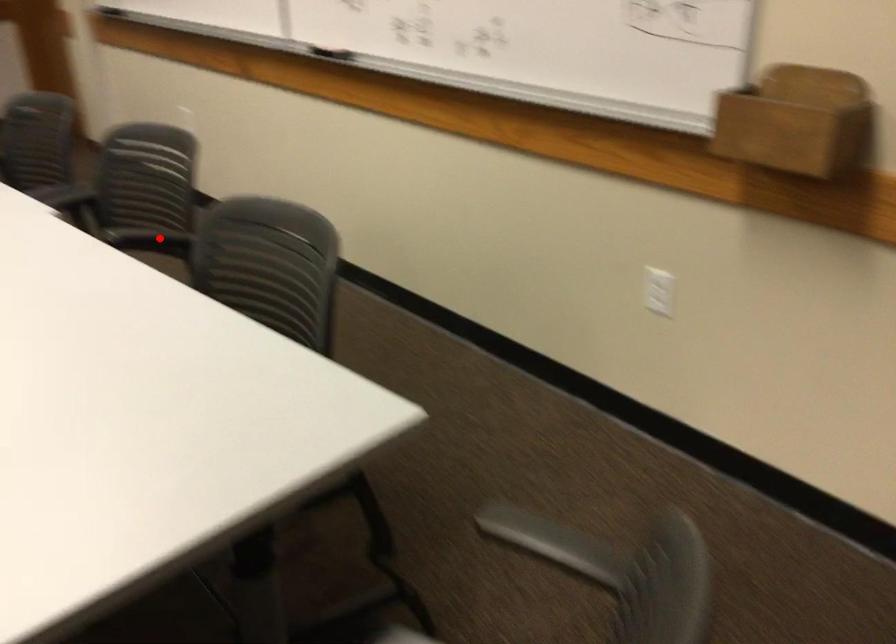
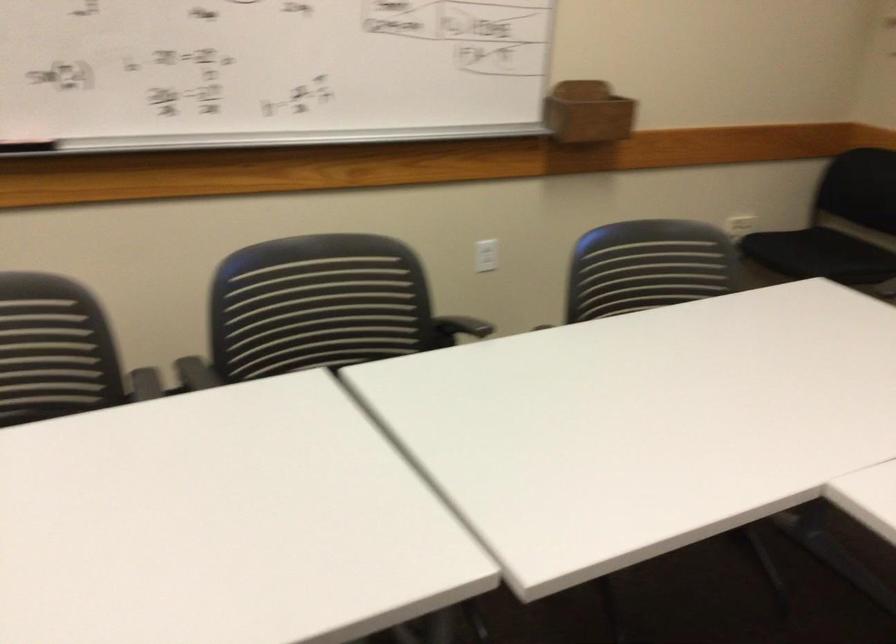
The point at the highlighted location is marked in the first image. Where is the corresponding point in the second image?

(458, 328)